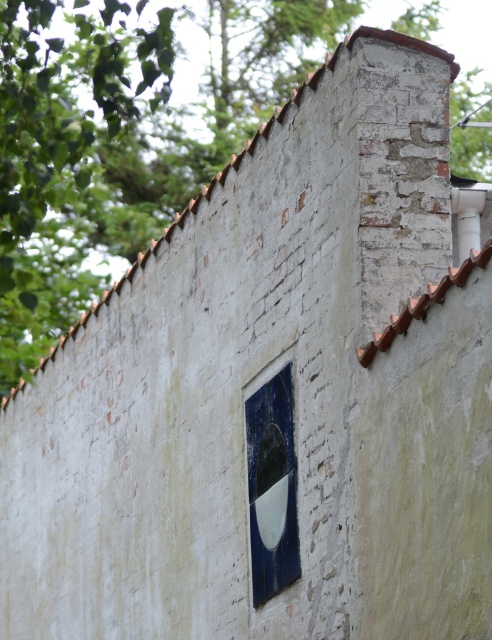
You are an artist planning to paint a mural on the wall. You want to ensure that the green leafy tree at upper left and the blue glossy tile at center are both visible in your design. Based on their widths, which object should you prioritize placing first to avoid overlapping?

The green leafy tree at upper left might be wider than blue glossy tile at center, so you should prioritize placing the green leafy tree at upper left first to ensure it fits without overlapping the blue glossy tile at center.

You are an artist planning to paint a mural on the wall shown in the image. You want to ensure that the green leafy tree at upper left and the blue glossy tile at center are both visible in your design. Given their sizes, which object should you make smaller to maintain balance in the composition?

The green leafy tree at upper left is much taller than the blue glossy tile at center, so to maintain balance in the composition, you should make the green leafy tree at upper left smaller.